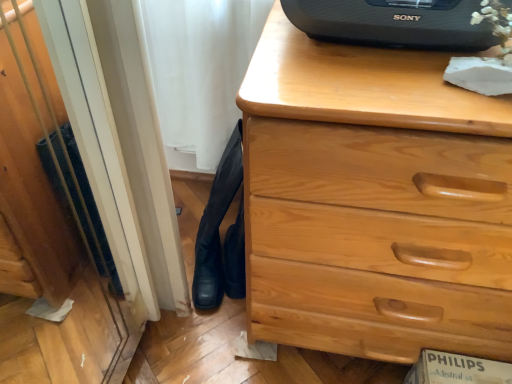
This screenshot has width=512, height=384. Find the location of `free space in front of black leather boots at lower left`. free space in front of black leather boots at lower left is located at coordinates (221, 344).